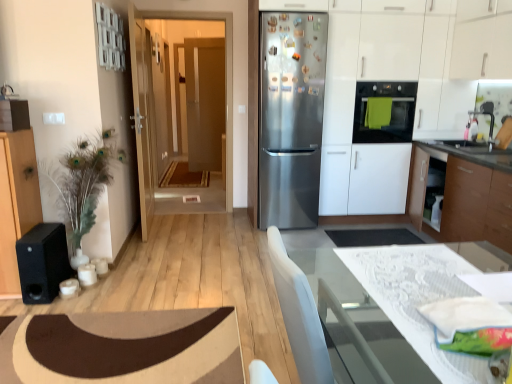
Question: Is black matte speaker at left to the left of satin white cabinet at right from the viewer's perspective?

Choices:
 (A) no
 (B) yes

Answer: (B)

Question: Considering the relative sizes of black matte speaker at left and satin white cabinet at right in the image provided, is black matte speaker at left taller than satin white cabinet at right?

Choices:
 (A) no
 (B) yes

Answer: (A)

Question: Does black matte speaker at left have a greater width compared to satin white cabinet at right?

Choices:
 (A) no
 (B) yes

Answer: (A)

Question: Can we say black matte speaker at left lies outside satin white cabinet at right?

Choices:
 (A) no
 (B) yes

Answer: (B)

Question: Is black matte speaker at left oriented towards satin white cabinet at right?

Choices:
 (A) no
 (B) yes

Answer: (A)

Question: Based on their positions, is white glossy countertop at lower right located to the left or right of stainless steel refrigerator at center?

Choices:
 (A) left
 (B) right

Answer: (B)

Question: From their relative heights in the image, would you say white glossy countertop at lower right is taller or shorter than stainless steel refrigerator at center?

Choices:
 (A) tall
 (B) short

Answer: (B)

Question: Is white glossy countertop at lower right wider or thinner than stainless steel refrigerator at center?

Choices:
 (A) wide
 (B) thin

Answer: (A)

Question: Relative to stainless steel refrigerator at center, is white glossy countertop at lower right in front or behind?

Choices:
 (A) behind
 (B) front

Answer: (B)

Question: Relative to matte wooden door at center, acting as the 2th door starting from the front, is matte black oven at center right in front or behind?

Choices:
 (A) behind
 (B) front

Answer: (B)

Question: From their relative heights in the image, would you say matte black oven at center right is taller or shorter than matte wooden door at center, marked as the first door in a back-to-front arrangement?

Choices:
 (A) tall
 (B) short

Answer: (B)

Question: Does point (401, 109) appear closer or farther from the camera than point (217, 119)?

Choices:
 (A) closer
 (B) farther

Answer: (A)

Question: Do you think matte black oven at center right is within matte wooden door at center, marked as the first door in a back-to-front arrangement, or outside of it?

Choices:
 (A) outside
 (B) inside

Answer: (A)

Question: Is white lace table at lower right situated inside matte wooden door at center, acting as the 2th door starting from the front, or outside?

Choices:
 (A) inside
 (B) outside

Answer: (B)

Question: Looking at their shapes, would you say white lace table at lower right is wider or thinner than matte wooden door at center, marked as the first door in a back-to-front arrangement?

Choices:
 (A) thin
 (B) wide

Answer: (B)